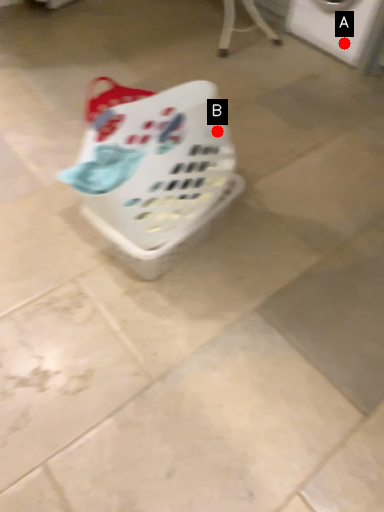
Question: Two points are circled on the image, labeled by A and B beside each circle. Which point is farther to the camera?

Choices:
 (A) A is further
 (B) B is further

Answer: (A)